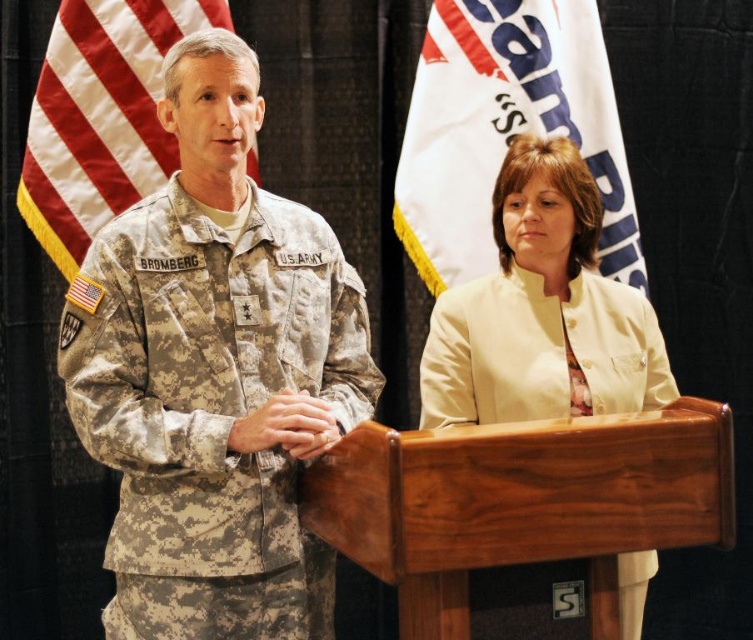
Question: Which point appears farthest from the camera in this image?

Choices:
 (A) (444, 461)
 (B) (273, 348)
 (C) (474, 220)
 (D) (428, 378)

Answer: (C)

Question: Is matte yellow jacket at center wider than camouflage fabric flag at left?

Choices:
 (A) yes
 (B) no

Answer: (B)

Question: Can you confirm if camouflage uniform at center is thinner than camouflage fabric flag at left?

Choices:
 (A) yes
 (B) no

Answer: (B)

Question: Which of the following is the farthest from the observer?

Choices:
 (A) camouflage fabric flag at left
 (B) white fabric flag at upper center
 (C) matte yellow jacket at center

Answer: (B)

Question: Which object is closer to the camera taking this photo?

Choices:
 (A) matte yellow jacket at center
 (B) camouflage fabric flag at left
 (C) wooden podium at center

Answer: (C)

Question: Does wooden podium at center have a smaller size compared to matte yellow jacket at center?

Choices:
 (A) yes
 (B) no

Answer: (B)